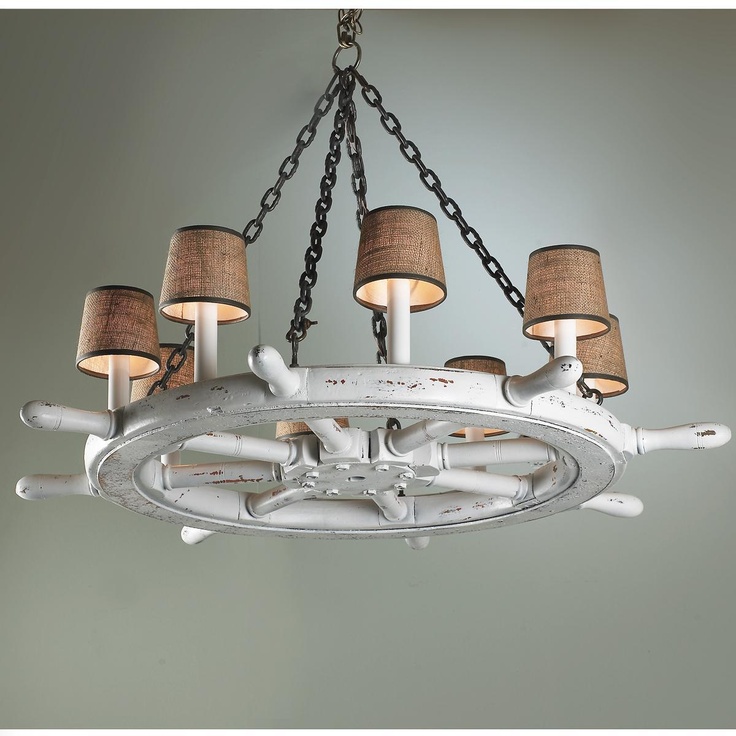
Where is `wall`? wall is located at coordinates (260, 598).